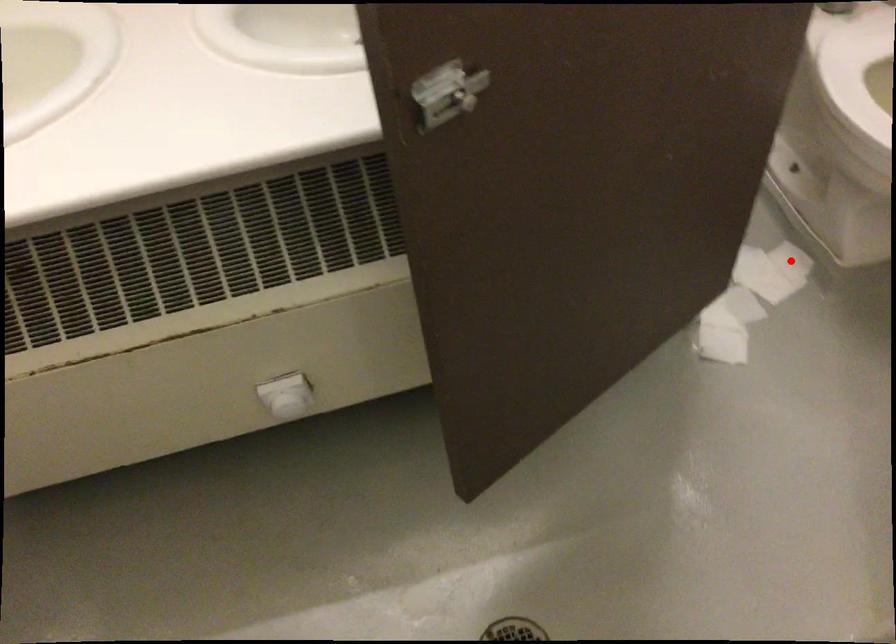
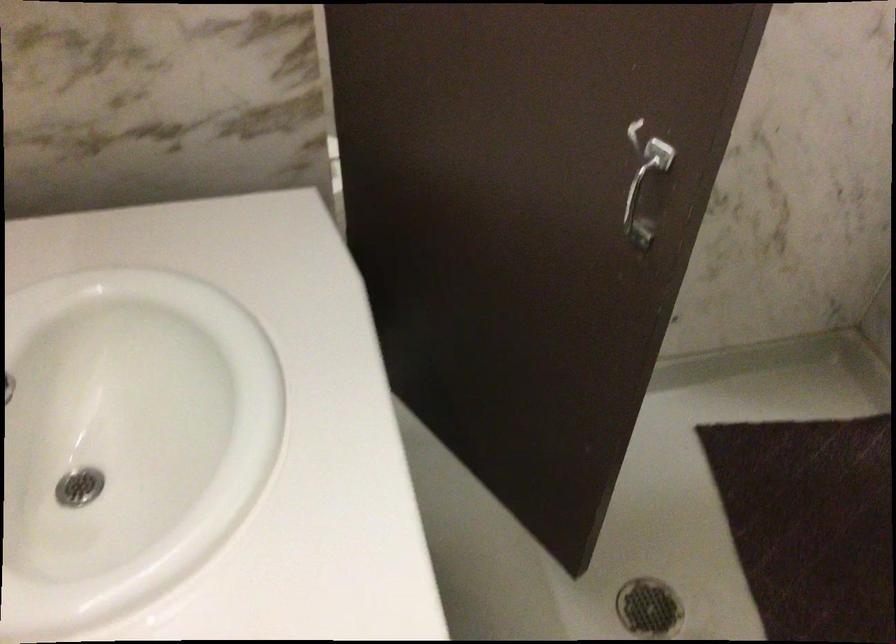
Question: I am providing you with two images of the same scene from different viewpoints. A red point is marked on the first image. Can you still see the location of the red point in image 2?

Choices:
 (A) Yes
 (B) No

Answer: (B)